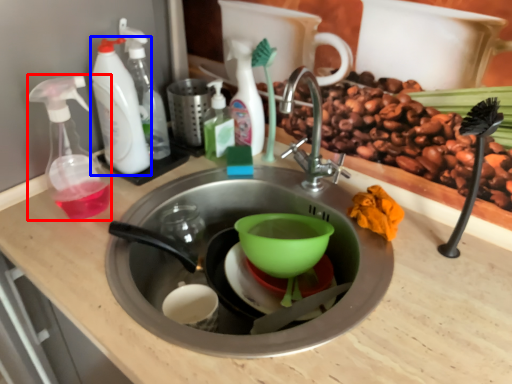
Question: Which object is further to the camera taking this photo, soap dispenser (highlighted by a red box) or cleaning product (highlighted by a blue box)?

Choices:
 (A) soap dispenser
 (B) cleaning product

Answer: (B)